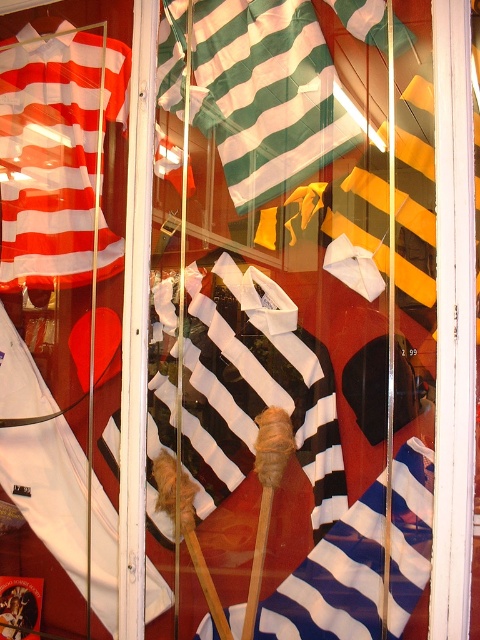
Can you confirm if green striped fabric at center is shorter than blue striped fabric at center?

No, green striped fabric at center is not shorter than blue striped fabric at center.

Is green striped fabric at center taller than blue striped fabric at center?

Correct, green striped fabric at center is much taller as blue striped fabric at center.

Where is `green striped fabric at center`? This screenshot has height=640, width=480. green striped fabric at center is located at coordinates (267, 93).

Does red striped fabric at left appear on the left side of blue striped fabric at center?

Correct, you'll find red striped fabric at left to the left of blue striped fabric at center.

Is point (46, 252) closer to viewer compared to point (289, 620)?

That is False.

I want to click on red striped fabric at left, so click(x=55, y=150).

Does green striped fabric at center appear on the left side of red striped fabric at left?

No, green striped fabric at center is not to the left of red striped fabric at left.

How far apart are green striped fabric at center and red striped fabric at left?

green striped fabric at center and red striped fabric at left are 13.42 inches apart from each other.

Which is in front, point (296, 173) or point (76, 97)?

Point (296, 173)

The height and width of the screenshot is (640, 480). Identify the location of green striped fabric at center. (267, 93).